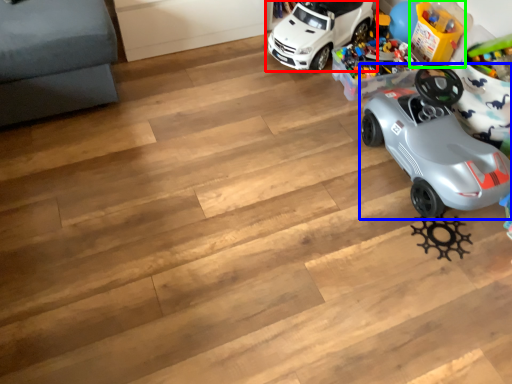
Question: Based on their relative distances, which object is nearer to car (highlighted by a red box)? Choose from car (highlighted by a blue box) and toy (highlighted by a green box).

Choices:
 (A) car
 (B) toy

Answer: (B)